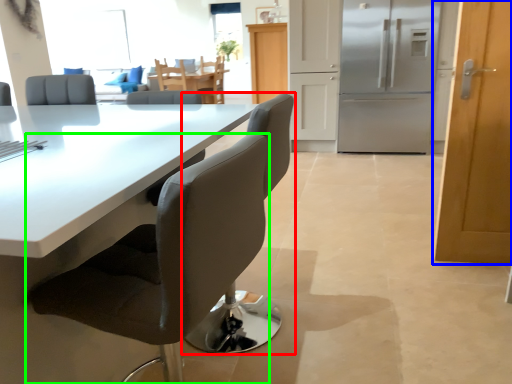
Question: Which object is the closest to the chair (highlighted by a red box)? Choose among these: door (highlighted by a blue box) or chair (highlighted by a green box).

Choices:
 (A) door
 (B) chair

Answer: (B)